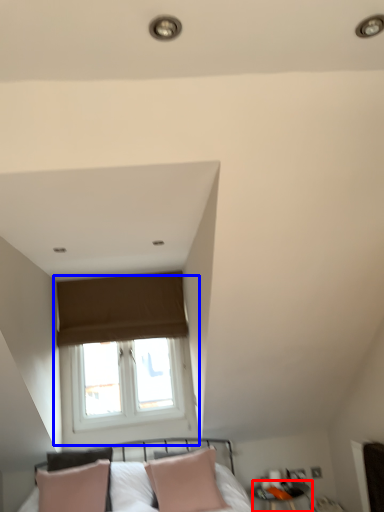
Question: Which point is closer to the camera, side table (highlighted by a red box) or window (highlighted by a blue box)?

Choices:
 (A) side table
 (B) window

Answer: (A)